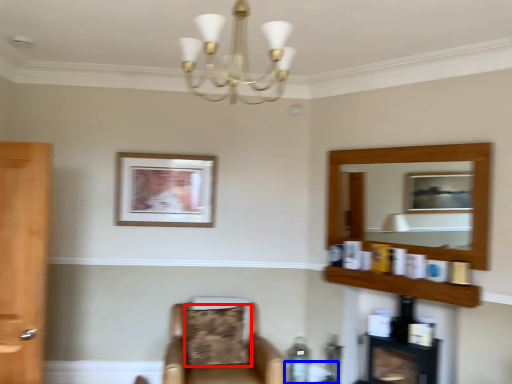
Question: Which point is closer to the camera, pillow (highlighted by a red box) or round table (highlighted by a blue box)?

Choices:
 (A) pillow
 (B) round table

Answer: (A)